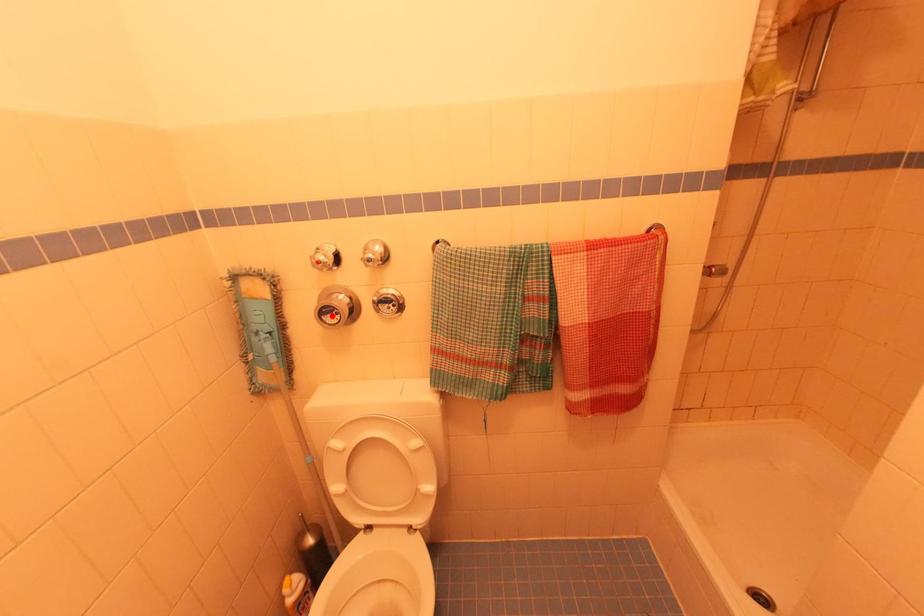
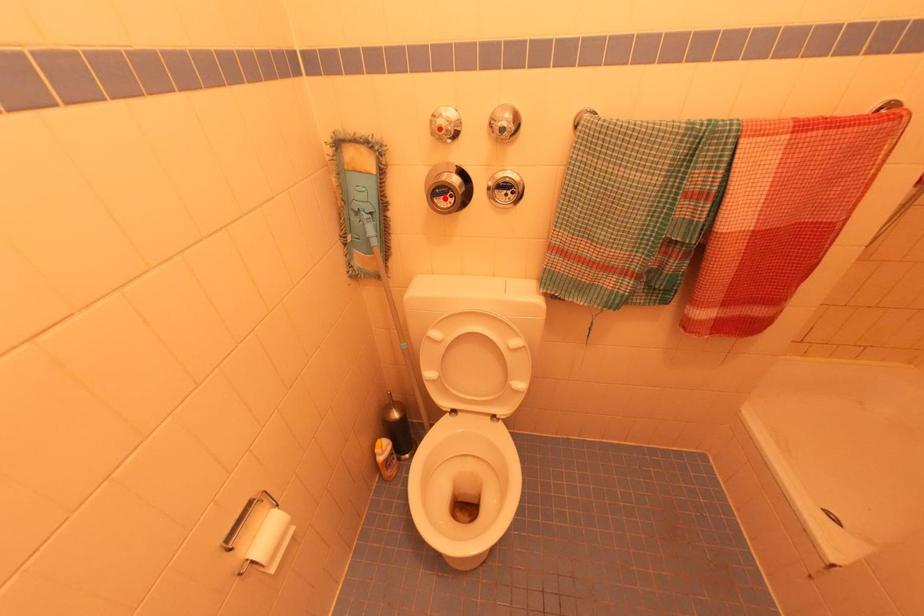
I am providing you with two images of the same scene from different viewpoints. A red point is marked on the first image and another point is marked on the second image. Are the points marked in image1 and image2 representing the same 3D position?

Yes